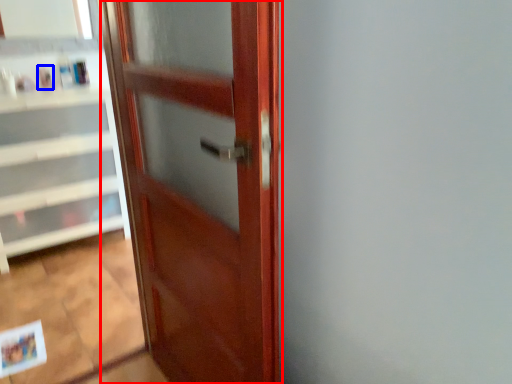
Question: Among these objects, which one is nearest to the camera, door (highlighted by a red box) or toiletry (highlighted by a blue box)?

Choices:
 (A) door
 (B) toiletry

Answer: (A)